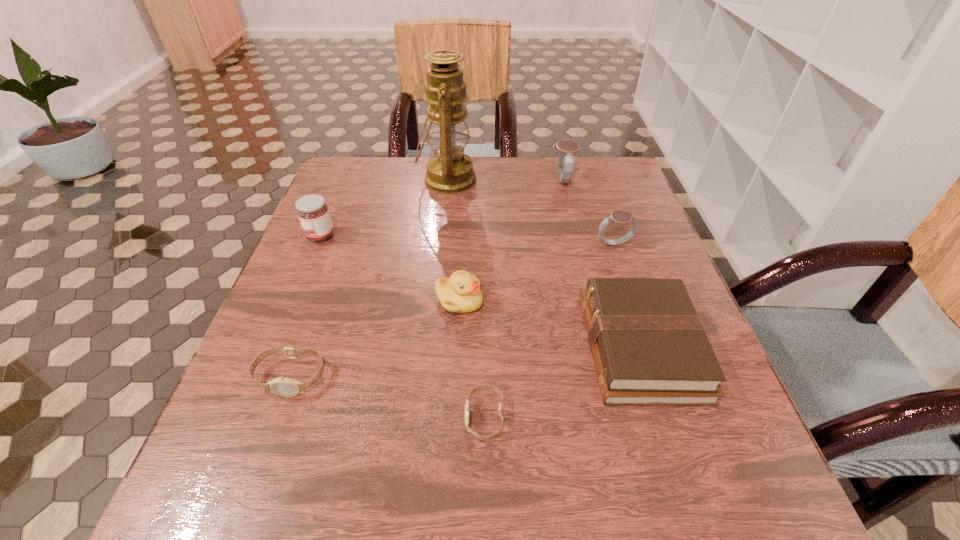
Identify the location of free space between the shortest watch and the left gray watch. This screenshot has height=540, width=960. (523, 299).

I want to click on vacant area between the smaller beige watch and the farthest watch, so click(x=523, y=299).

What are the coordinates of `free space between the farther gray watch and the red jam` in the screenshot? It's located at (442, 208).

This screenshot has height=540, width=960. I want to click on unoccupied position between the tallest object and the Bible, so click(544, 263).

Where is `unoccupied position between the second watch from right to left and the Bible`? Image resolution: width=960 pixels, height=540 pixels. unoccupied position between the second watch from right to left and the Bible is located at coordinates (602, 264).

Point out which object is positioned as the fourth nearest to the leftmost watch. Please provide its 2D coordinates. Your answer should be formatted as a tuple, i.e. [(x, y)], where the tuple contains the x and y coordinates of a point satisfying the conditions above.

[(649, 346)]

Locate an element on the screen. This screenshot has height=540, width=960. object that ranks as the second closest to the third tallest watch is located at coordinates (492, 388).

In order to click on watch identified as the second closest to the sixth tallest object in this screenshot , I will do `click(492, 388)`.

Select which watch appears as the closest to the right gray watch. Please provide its 2D coordinates. Your answer should be formatted as a tuple, i.e. [(x, y)], where the tuple contains the x and y coordinates of a point satisfying the conditions above.

[(567, 148)]